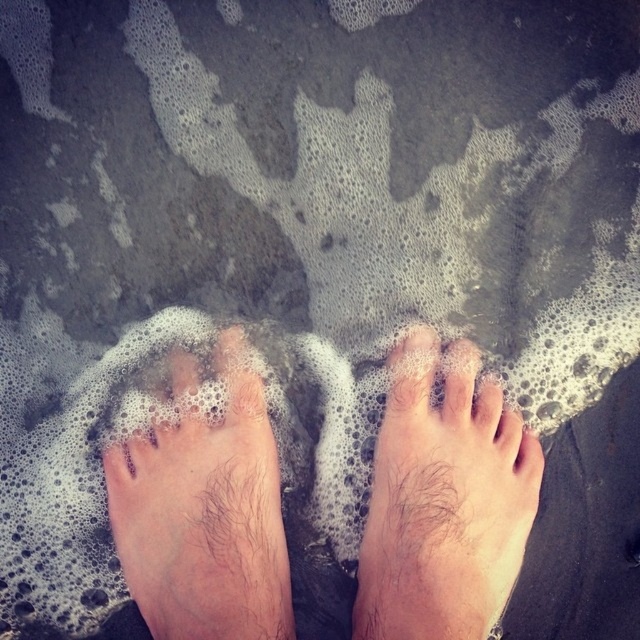
Question: Which point appears farthest from the camera in this image?

Choices:
 (A) (209, 625)
 (B) (257, 401)
 (C) (449, 362)
 (D) (420, 524)

Answer: (C)

Question: Which object appears farthest from the camera in this image?

Choices:
 (A) hairy skin foot at lower left
 (B) dry skin toe at center
 (C) hairy skin foot at lower center

Answer: (B)

Question: From the image, what is the correct spatial relationship of hairy skin feet at center in relation to dry skin toe at center?

Choices:
 (A) below
 (B) above

Answer: (A)

Question: Does hairy skin feet at center have a lesser width compared to dry skin toe at center?

Choices:
 (A) no
 (B) yes

Answer: (A)

Question: Which object is farther from the camera taking this photo?

Choices:
 (A) hairy skin foot at lower center
 (B) dry skin toe at center
 (C) hairy skin foot at lower left

Answer: (B)

Question: Is hairy skin feet at center wider than hairy skin foot at lower center?

Choices:
 (A) yes
 (B) no

Answer: (A)